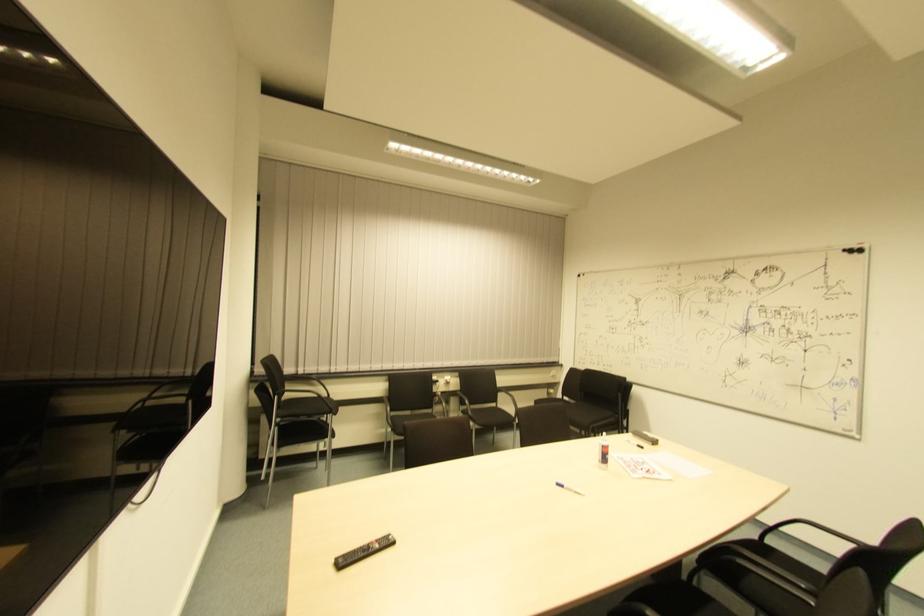
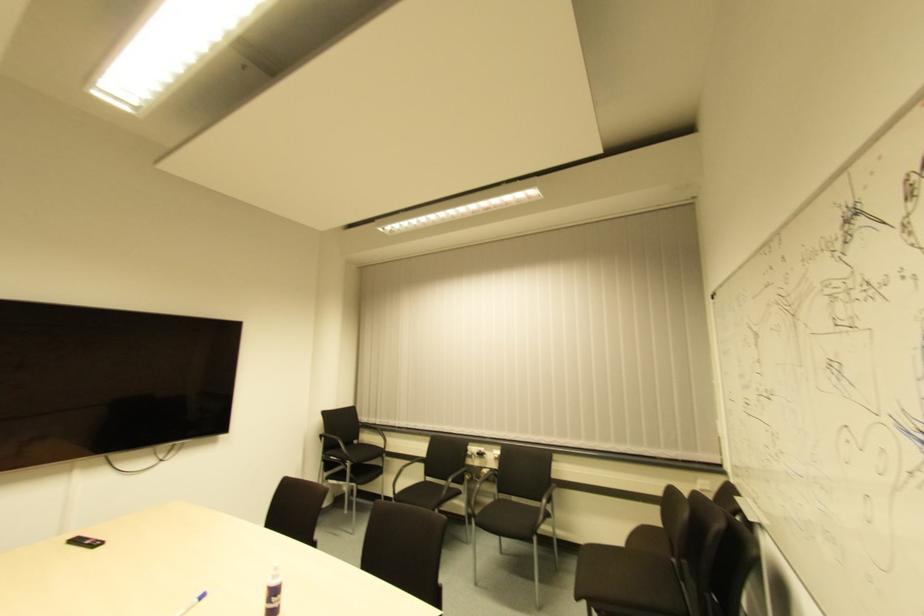
Locate, in the second image, the point that corresponds to the point at 602,447 in the first image.

(274, 586)